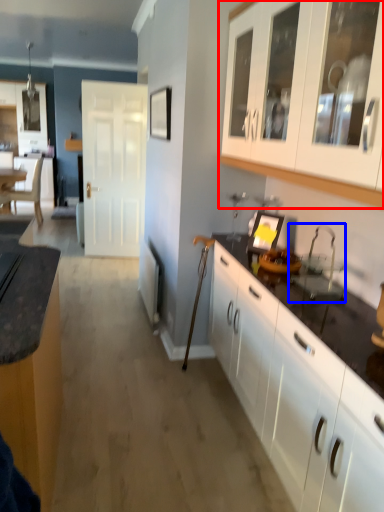
Question: Which point is further to the camera, cabinetry (highlighted by a red box) or sink (highlighted by a blue box)?

Choices:
 (A) cabinetry
 (B) sink

Answer: (B)